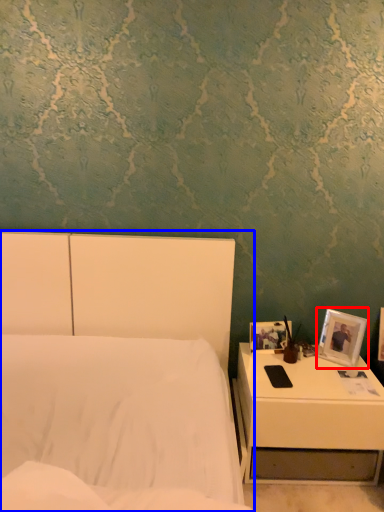
Question: Which object is further to the camera taking this photo, picture frame (highlighted by a red box) or bed (highlighted by a blue box)?

Choices:
 (A) picture frame
 (B) bed

Answer: (A)